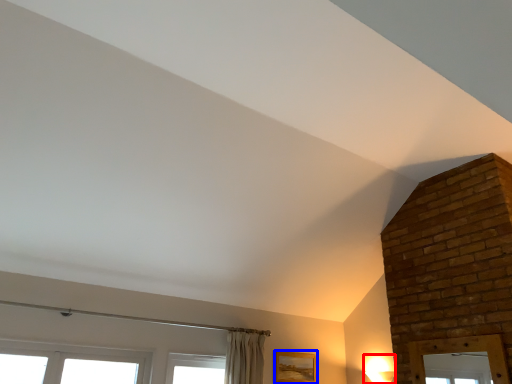
Question: Which object appears closest to the camera in this image, light fixture (highlighted by a red box) or picture frame (highlighted by a blue box)?

Choices:
 (A) light fixture
 (B) picture frame

Answer: (A)